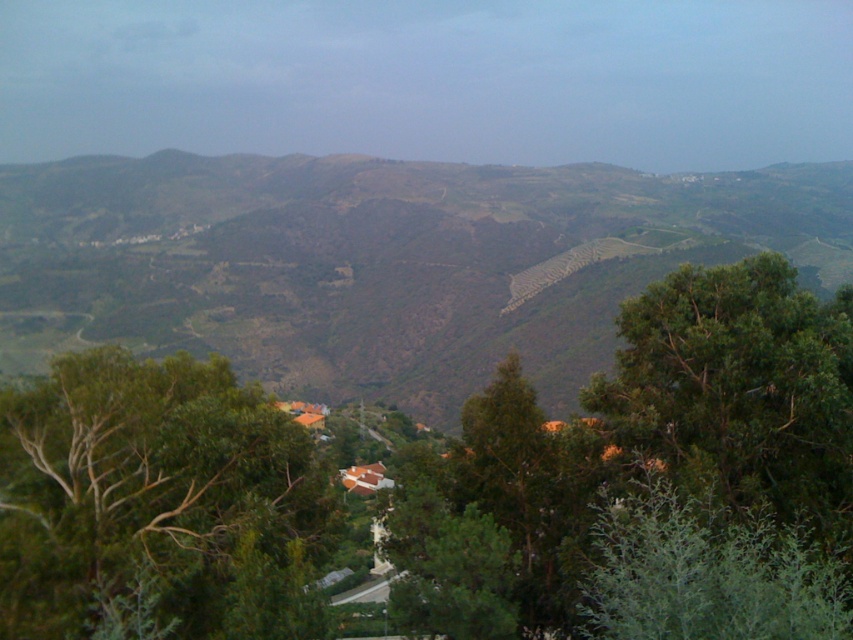
Does green leafy tree at lower left have a greater width compared to green leafy tree at center-right?

Yes.

Which is above, green leafy tree at lower left or green leafy tree at center-right?

green leafy tree at center-right is higher up.

Between point (258, 593) and point (656, 420), which one is positioned behind?

The point (656, 420) is more distant.

Where is `green leafy tree at lower left`? Image resolution: width=853 pixels, height=640 pixels. green leafy tree at lower left is located at coordinates (154, 504).

This screenshot has width=853, height=640. Identify the location of green grassy hillside at center. [380, 262].

Between green grassy hillside at center and green leafy tree at lower left, which one is positioned lower?

green leafy tree at lower left is lower down.

In the scene shown: Who is more distant from viewer, (610, 241) or (276, 432)?

The point (610, 241) is behind.

What are the coordinates of `green grassy hillside at center` in the screenshot? It's located at (380, 262).

Does green grassy hillside at center have a lesser width compared to green leafy tree at center-right?

Incorrect, green grassy hillside at center's width is not less than green leafy tree at center-right's.

What do you see at coordinates (380, 262) in the screenshot? I see `green grassy hillside at center` at bounding box center [380, 262].

Which is in front, point (833, 163) or point (708, 480)?

Point (708, 480)

This screenshot has width=853, height=640. I want to click on green grassy hillside at center, so click(x=380, y=262).